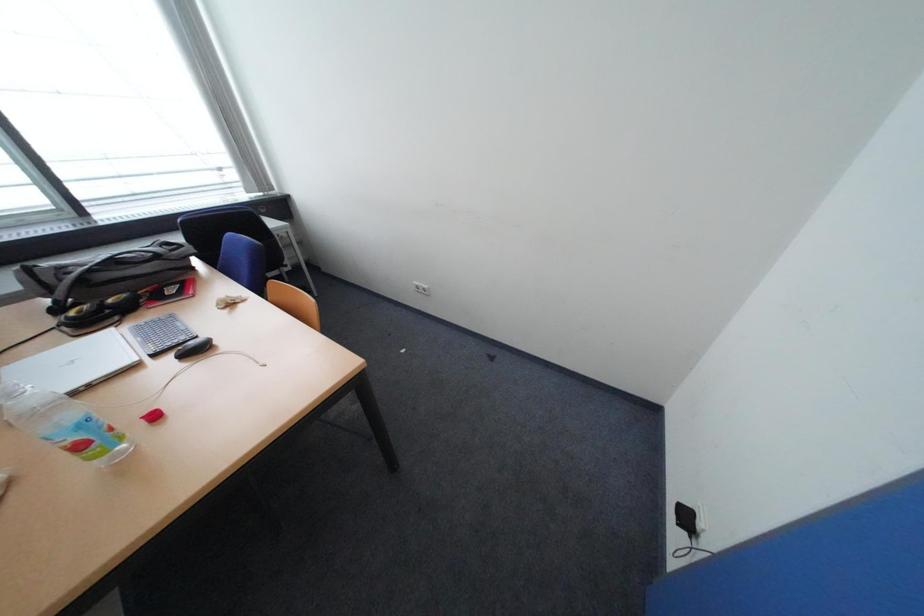
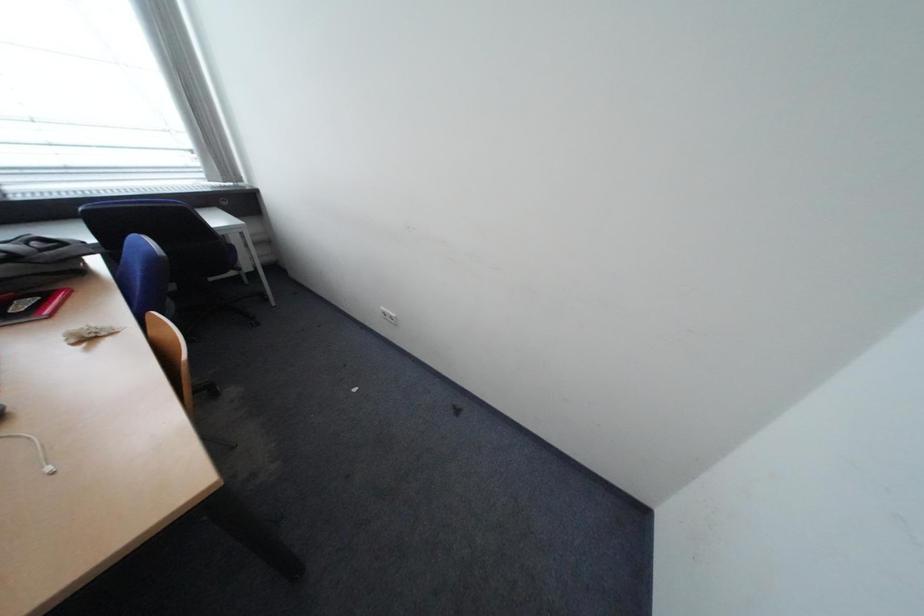
What movement of the cameraman would produce the second image?

The movement direction of the cameraman is right, forward.